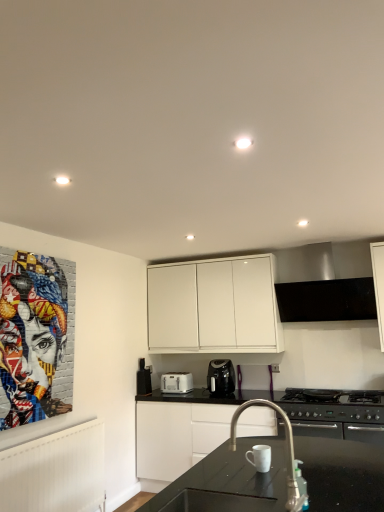
Question: From the image's perspective, relative to white matte cabinet at upper center, the 1th cabinetry when ordered from top to bottom, is black plastic coffee maker at center, the 2th kitchen appliance from the left, above or below?

Choices:
 (A) above
 (B) below

Answer: (B)

Question: Does point (228, 364) appear closer or farther from the camera than point (238, 332)?

Choices:
 (A) farther
 (B) closer

Answer: (A)

Question: Considering the real-world distances, which object is farthest from the colorful mosaic portrait at left?

Choices:
 (A) white plastic toaster at center, the second kitchen appliance positioned from the right
 (B) white matte cabinet at upper center, the 1th cabinetry when ordered from top to bottom
 (C) black plastic toaster at lower center, placed as the 2th appliance when sorted from right to left
 (D) black glossy sink at center
 (E) white ceramic mug at lower center, placed as the 1th appliance when sorted from right to left

Answer: (E)

Question: Estimate the real-world distances between objects in this image. Which object is farther from the satin nickel faucet at center?

Choices:
 (A) satin silver exhaust hood at upper center
 (B) colorful mosaic portrait at left
 (C) white plastic toaster at center, the 1th kitchen appliance from the left
 (D) black matte gas stove at lower right
 (E) black glossy sink at center

Answer: (C)